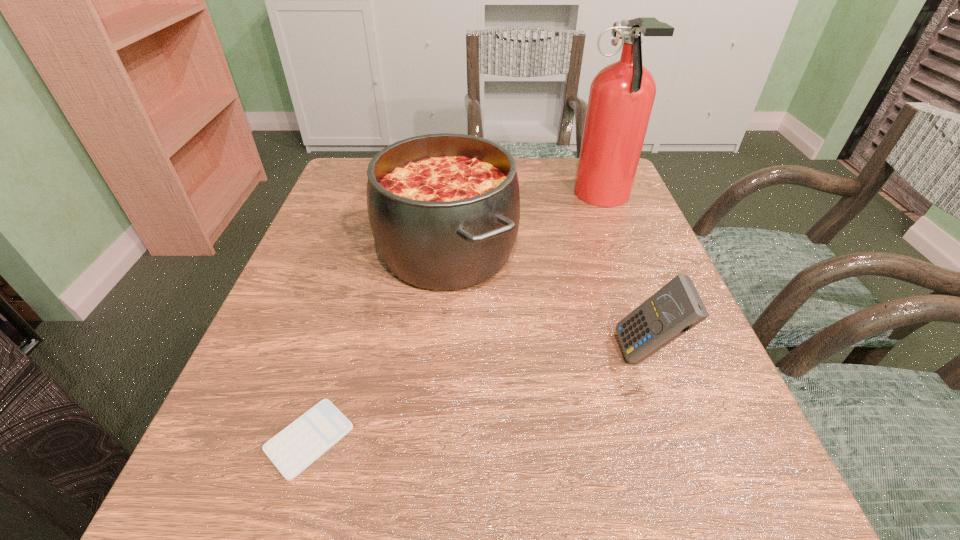
At what (x,y) coordinates should I click in order to perform the action: click on the tallest object. Please return your answer as a coordinate pair (x, y). Looking at the image, I should click on (622, 94).

Identify the location of the second tallest object. This screenshot has height=540, width=960. (444, 209).

Identify the location of the third farthest object. This screenshot has width=960, height=540. point(676,308).

Identify the location of the third tallest object. This screenshot has height=540, width=960. (676, 308).

The height and width of the screenshot is (540, 960). What are the coordinates of `the left calculator` in the screenshot? It's located at (296, 447).

Identify the location of the nearest object. The image size is (960, 540). (296, 447).

You are a GUI agent. You are given a task and a screenshot of the screen. Output one action in this format:
    pyautogui.click(x=<x>, y=<y>)
    Task: Click on the vacant point located on the front of the tallest object
    
    Given the screenshot: What is the action you would take?
    pyautogui.click(x=650, y=321)

Image resolution: width=960 pixels, height=540 pixels. Find the location of `vacant region located 0.050m on the front of the casserole`. vacant region located 0.050m on the front of the casserole is located at coordinates (441, 333).

Identify the location of free location located on the front-facing side of the third farthest object. (384, 353).

Where is `vacant region located 0.100m on the front-facing side of the third farthest object`? The image size is (960, 540). vacant region located 0.100m on the front-facing side of the third farthest object is located at coordinates (558, 353).